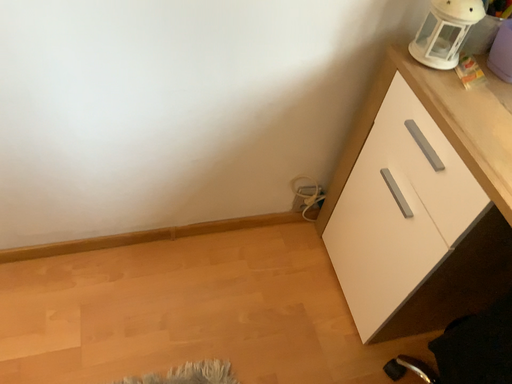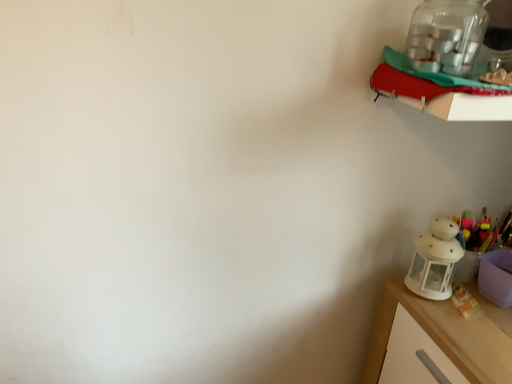
Question: Which way did the camera rotate in the video?

Choices:
 (A) rotated downward
 (B) rotated upward

Answer: (B)